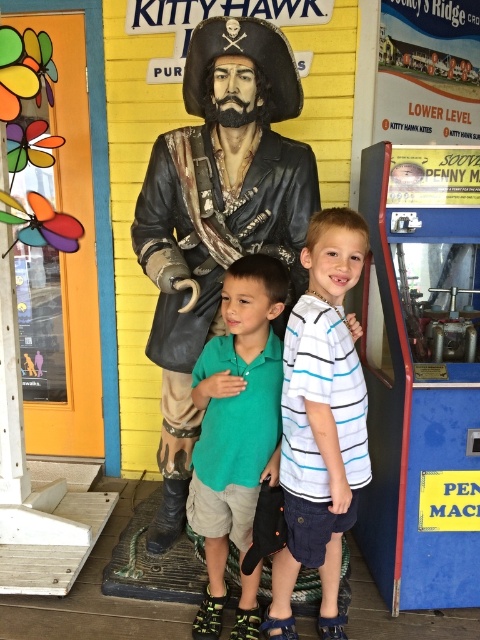
From the picture: Who is positioned more to the left, bronze pirate at center or green cotton polo shirt at center?

bronze pirate at center is more to the left.

The width and height of the screenshot is (480, 640). Describe the element at coordinates (216, 218) in the screenshot. I see `bronze pirate at center` at that location.

Describe the element at coordinates (216, 218) in the screenshot. I see `bronze pirate at center` at that location.

Locate an element on the screen. The image size is (480, 640). bronze pirate at center is located at coordinates (216, 218).

Is bronze pirate at center below white striped shirt at center?

No.

Does bronze pirate at center have a lesser height compared to white striped shirt at center?

No.

This screenshot has width=480, height=640. What are the coordinates of `bronze pirate at center` in the screenshot? It's located at (216, 218).

Is point (285, 592) farther from viewer compared to point (219, 548)?

No, (285, 592) is closer to viewer.

Is white striped shirt at center thinner than green cotton polo shirt at center?

In fact, white striped shirt at center might be wider than green cotton polo shirt at center.

Is point (356, 356) more distant than point (206, 484)?

No.

You are a GUI agent. You are given a task and a screenshot of the screen. Output one action in this format:
    pyautogui.click(x=<x>, y=<y>)
    Task: Click on the white striped shirt at center
    
    Given the screenshot: What is the action you would take?
    pyautogui.click(x=321, y=420)